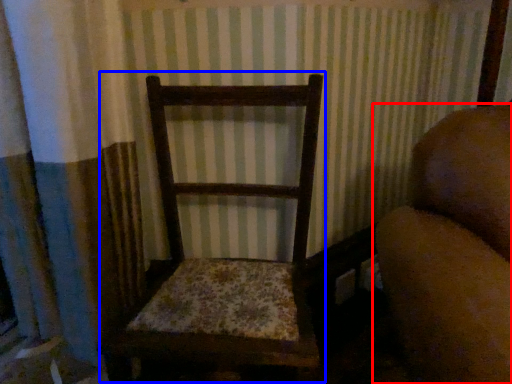
Question: Which object appears closest to the camera in this image, furniture (highlighted by a red box) or rocking chair (highlighted by a blue box)?

Choices:
 (A) furniture
 (B) rocking chair

Answer: (A)